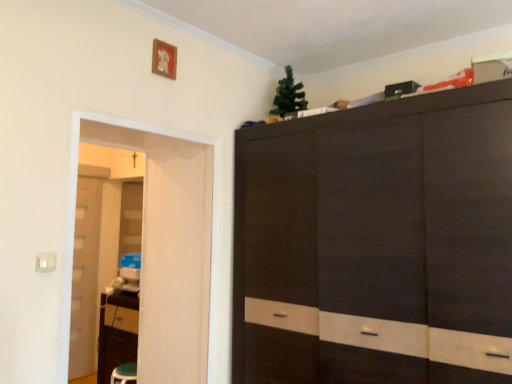
What do you see at coordinates (168, 242) in the screenshot? I see `translucent plastic screen door at left` at bounding box center [168, 242].

Identify the location of translucent plastic screen door at left. click(168, 242).

Image resolution: width=512 pixels, height=384 pixels. What do you see at coordinates (85, 276) in the screenshot?
I see `white glossy door at left` at bounding box center [85, 276].

I want to click on white glossy door at left, so coord(85,276).

At what (x,y) coordinates should I click in order to perform the action: click on translucent plastic screen door at left. Please return your answer as a coordinate pair (x, y). Looking at the image, I should click on (168, 242).

Between translucent plastic screen door at left and white glossy door at left, which one appears on the left side from the viewer's perspective?

Positioned to the left is white glossy door at left.

Which is in front, translucent plastic screen door at left or white glossy door at left?

translucent plastic screen door at left.

Between point (186, 242) and point (73, 328), which one is positioned in front?

The point (186, 242) is closer.

From the image's perspective, relative to white glossy door at left, is translucent plastic screen door at left above or below?

Based on their image positions, translucent plastic screen door at left is located above white glossy door at left.

From a real-world perspective, which is physically above, translucent plastic screen door at left or white glossy door at left?

From a 3D spatial view, translucent plastic screen door at left is above.

Is translucent plastic screen door at left wider than white glossy door at left?

In fact, translucent plastic screen door at left might be narrower than white glossy door at left.

Can you confirm if translucent plastic screen door at left is taller than white glossy door at left?

Incorrect, the height of translucent plastic screen door at left is not larger of that of white glossy door at left.

Considering the relative sizes of translucent plastic screen door at left and white glossy door at left in the image provided, is translucent plastic screen door at left smaller than white glossy door at left?

Correct, translucent plastic screen door at left occupies less space than white glossy door at left.

Can white glossy door at left be found inside translucent plastic screen door at left?

Definitely not — white glossy door at left is not inside translucent plastic screen door at left.

Are translucent plastic screen door at left and white glossy door at left beside each other?

translucent plastic screen door at left is not next to white glossy door at left, and they're not touching.

Is white glossy door at left at the back of translucent plastic screen door at left?

Yes, white glossy door at left is at the back of translucent plastic screen door at left.

Measure the distance between translucent plastic screen door at left and white glossy door at left.

translucent plastic screen door at left is 2.19 meters from white glossy door at left.

Where is `door lying below the translucent plastic screen door at left (from the image's perspective)`? The width and height of the screenshot is (512, 384). door lying below the translucent plastic screen door at left (from the image's perspective) is located at coordinates (85, 276).

Which is more to the left, white glossy door at left or translucent plastic screen door at left?

white glossy door at left.

Considering the relative positions of white glossy door at left and translucent plastic screen door at left in the image provided, is white glossy door at left behind translucent plastic screen door at left?

Yes, white glossy door at left is behind translucent plastic screen door at left.

Is point (77, 217) in front of point (152, 181)?

No, it is not.

From the image's perspective, between white glossy door at left and translucent plastic screen door at left, which one is located above?

translucent plastic screen door at left appears higher in the image.

From a real-world perspective, which is physically above, white glossy door at left or translucent plastic screen door at left?

translucent plastic screen door at left, from a real-world perspective.

Considering the sizes of white glossy door at left and translucent plastic screen door at left in the image, is white glossy door at left wider or thinner than translucent plastic screen door at left?

Considering their sizes, white glossy door at left looks broader than translucent plastic screen door at left.

Considering the relative sizes of white glossy door at left and translucent plastic screen door at left in the image provided, is white glossy door at left shorter than translucent plastic screen door at left?

No.

In terms of size, does white glossy door at left appear bigger or smaller than translucent plastic screen door at left?

In the image, white glossy door at left appears to be larger than translucent plastic screen door at left.

Is white glossy door at left outside of translucent plastic screen door at left?

Indeed, white glossy door at left is completely outside translucent plastic screen door at left.

Is white glossy door at left positioned far away from translucent plastic screen door at left?

That's right, there is a large distance between white glossy door at left and translucent plastic screen door at left.

Is white glossy door at left facing away from translucent plastic screen door at left?

white glossy door at left does not have its back to translucent plastic screen door at left.

Where is `screen door lying in front of the white glossy door at left`? screen door lying in front of the white glossy door at left is located at coordinates (168, 242).

At what (x,y) coordinates should I click in order to perform the action: click on screen door above the white glossy door at left (from the image's perspective). Please return your answer as a coordinate pair (x, y). Looking at the image, I should click on point(168,242).

Find the location of `screen door in front of the white glossy door at left`. screen door in front of the white glossy door at left is located at coordinates (168, 242).